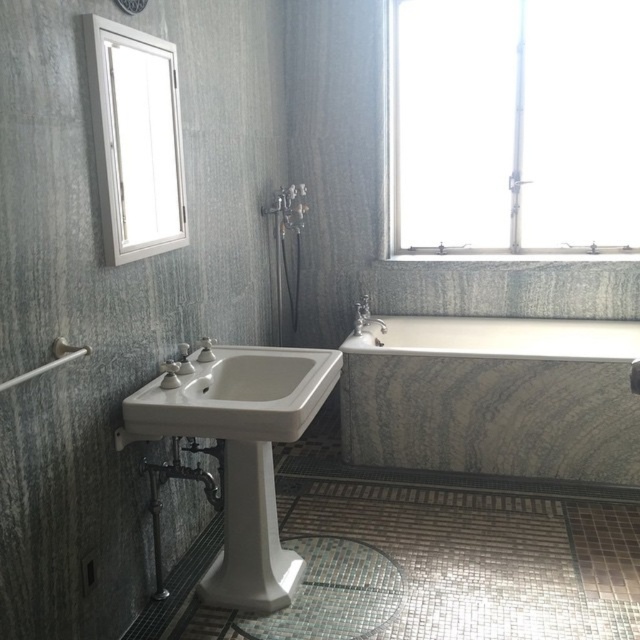
You are a home decorator planning to place a large plant in this bathroom. The plant requires a spot near a light source. Considering the transparent glass window at upper right and the matte silver faucet at center, which object should you place the plant near?

The transparent glass window at upper right is larger in size than the matte silver faucet at center, so the plant should be placed near the transparent glass window at upper right as it likely provides better natural light.

You are standing in the bathroom and want to open the transparent glass window at upper right to let some fresh air in. However, you need to pass by the matte silver faucet at center first. Is the window closer to you than the faucet?

Yes, the transparent glass window at upper right is closer to the viewer than the matte silver faucet at center, so you can reach the window first without obstruction from the faucet.